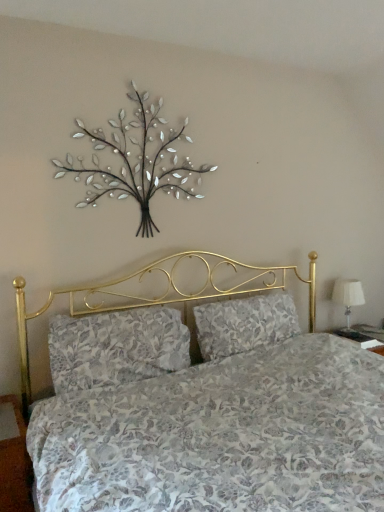
Find the location of `vacant point above metallic silver tree at upper center (from a real-world perspective)`. vacant point above metallic silver tree at upper center (from a real-world perspective) is located at coordinates (126, 73).